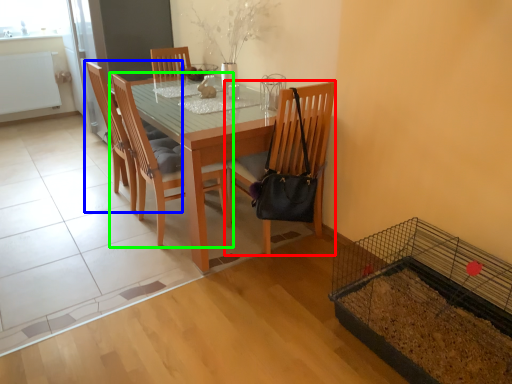
Question: Estimate the real-world distances between objects in this image. Which object is farther from chair (highlighted by a red box), chair (highlighted by a blue box) or chair (highlighted by a green box)?

Choices:
 (A) chair
 (B) chair

Answer: (A)